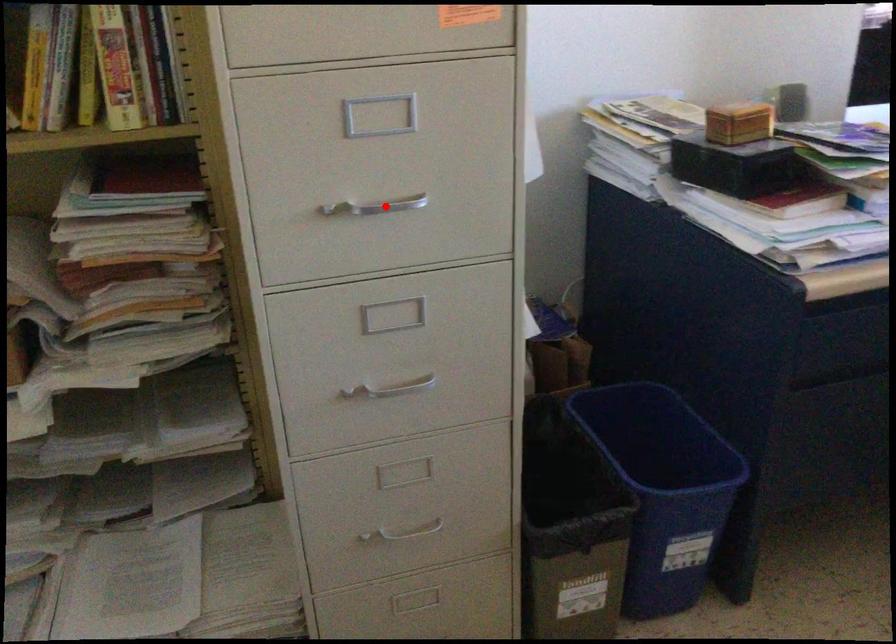
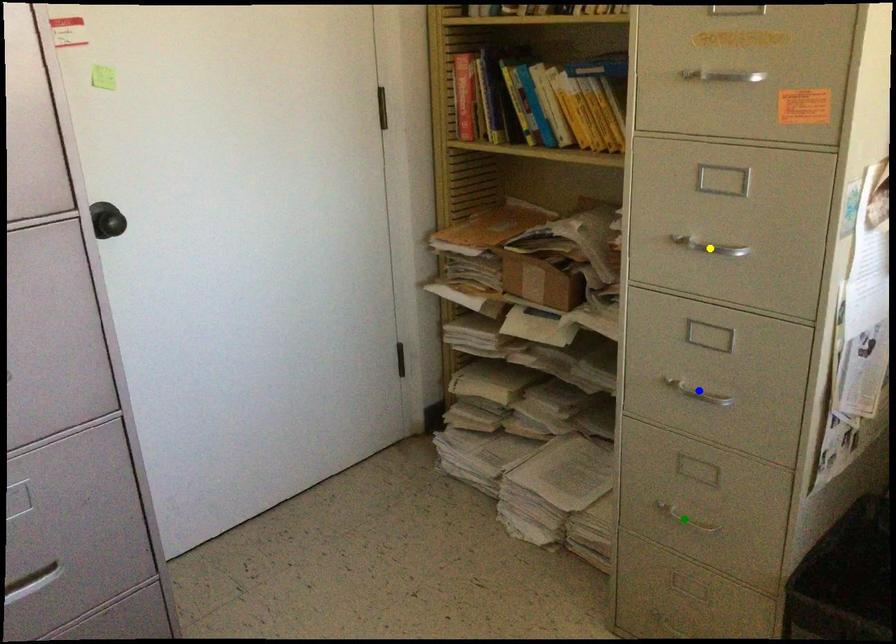
Question: I am providing you with two images of the same scene from different viewpoints. A red point is marked on the first image. You are given multiple points on the second image. Can you choose the point in image 2 that corresponds to the point in image 1?

Choices:
 (A) yellow point
 (B) green point
 (C) blue point

Answer: (A)